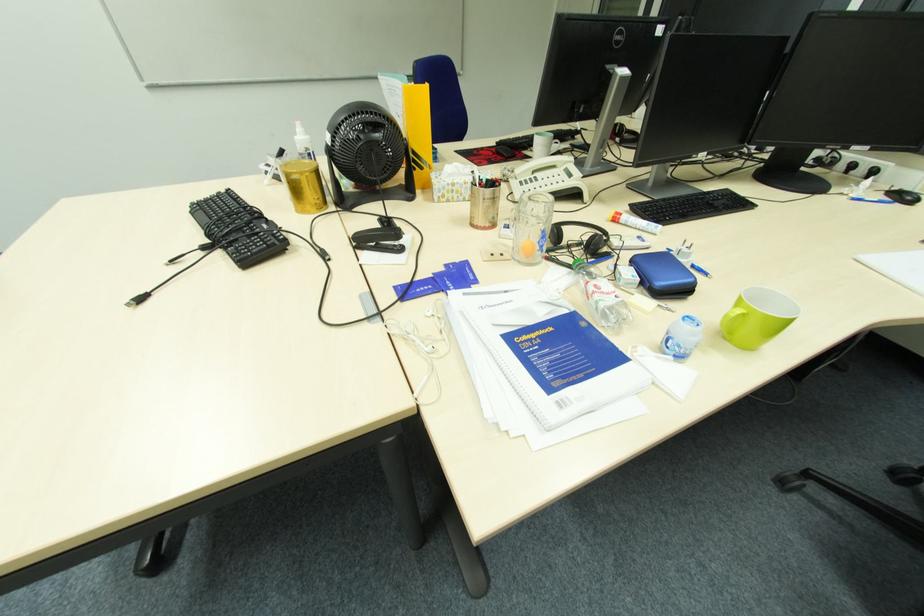
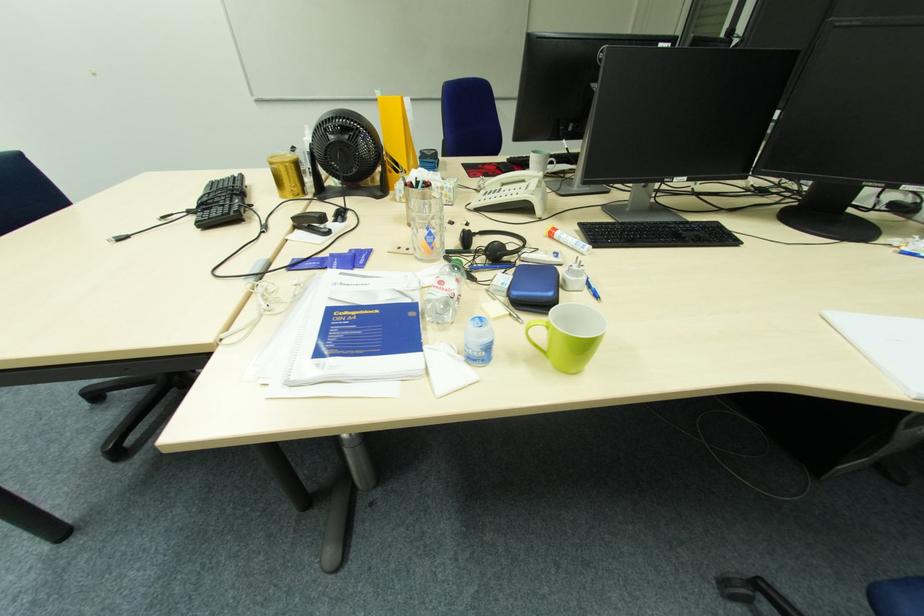
Question: In a continuous first-person perspective shot, in which direction is the camera moving?

Choices:
 (A) Left
 (B) Right
 (C) Forward
 (D) Backward

Answer: (B)